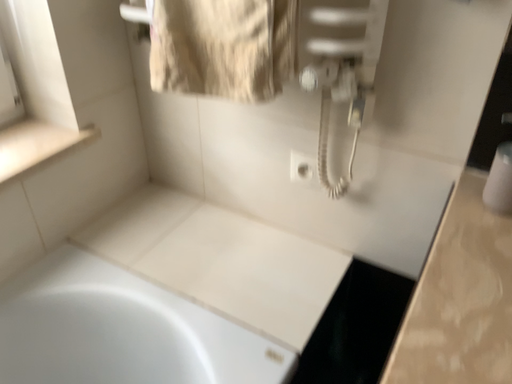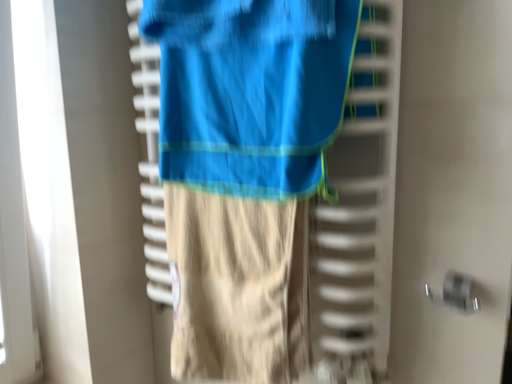
Question: Which way did the camera rotate in the video?

Choices:
 (A) rotated downward
 (B) rotated upward

Answer: (B)